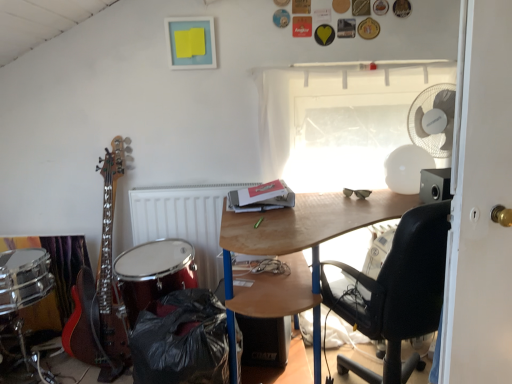
Question: Is transparent plastic window at upper center completely or partially inside shiny red drum at lower left?

Choices:
 (A) yes
 (B) no

Answer: (B)

Question: From a real-world perspective, is shiny red drum at lower left on transparent plastic window at upper center?

Choices:
 (A) yes
 (B) no

Answer: (B)

Question: Can you confirm if shiny red drum at lower left is taller than transparent plastic window at upper center?

Choices:
 (A) yes
 (B) no

Answer: (B)

Question: Can you confirm if shiny red drum at lower left is positioned to the right of transparent plastic window at upper center?

Choices:
 (A) no
 (B) yes

Answer: (A)

Question: Is shiny red drum at lower left in front of transparent plastic window at upper center?

Choices:
 (A) no
 (B) yes

Answer: (B)

Question: Relative to white matte radiator at center, is shiny red drum at lower left in front or behind?

Choices:
 (A) front
 (B) behind

Answer: (A)

Question: Considering the relative positions of shiny red drum at lower left and white matte radiator at center in the image provided, is shiny red drum at lower left to the left or to the right of white matte radiator at center?

Choices:
 (A) right
 (B) left

Answer: (B)

Question: Is shiny red drum at lower left wider or thinner than white matte radiator at center?

Choices:
 (A) wide
 (B) thin

Answer: (A)

Question: Is point (161, 274) closer or farther from the camera than point (140, 223)?

Choices:
 (A) closer
 (B) farther

Answer: (A)

Question: From the image's perspective, is transparent plastic window at upper center above or below white painted wood door at right?

Choices:
 (A) above
 (B) below

Answer: (A)

Question: In terms of height, does transparent plastic window at upper center look taller or shorter compared to white painted wood door at right?

Choices:
 (A) tall
 (B) short

Answer: (B)

Question: Considering the relative positions of transparent plastic window at upper center and white painted wood door at right in the image provided, is transparent plastic window at upper center to the left or to the right of white painted wood door at right?

Choices:
 (A) right
 (B) left

Answer: (B)

Question: Would you say transparent plastic window at upper center is inside or outside white painted wood door at right?

Choices:
 (A) outside
 (B) inside

Answer: (A)

Question: Is point (313, 130) closer or farther from the camera than point (432, 165)?

Choices:
 (A) farther
 (B) closer

Answer: (A)

Question: Do you think transparent plastic window at upper center is within white plastic mechanical fan at upper right, or outside of it?

Choices:
 (A) inside
 (B) outside

Answer: (B)